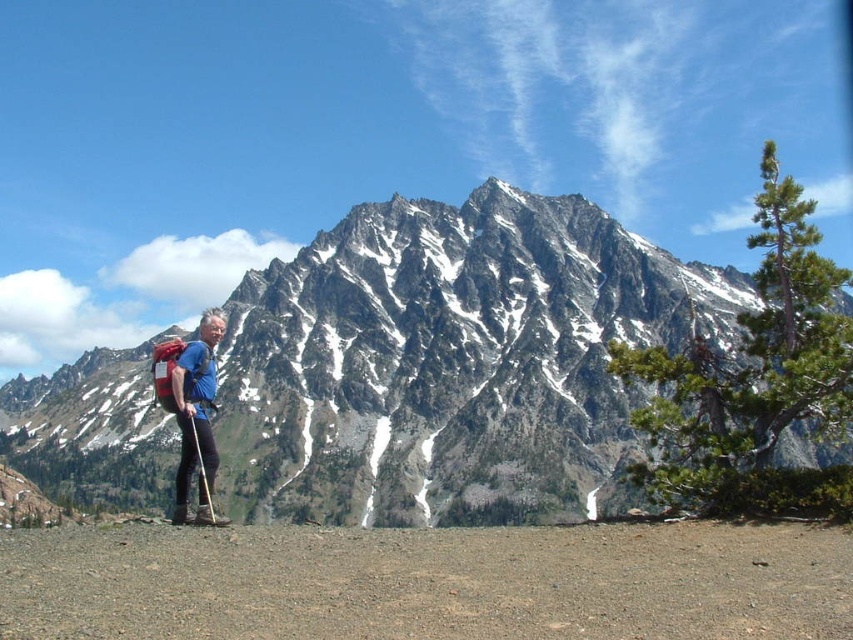
You are a drone operator trying to capture a photo of the mountain range. You need to fly your drone from point A to point B. Point A is at coordinates point (494,234) and point B is at coordinates point (653,412). Which point is closer to you, the operator, so you can decide the flight path?

Point (494,234) is closer to you than point (653,412) because it is further to the viewer, meaning it is nearer in the scene.